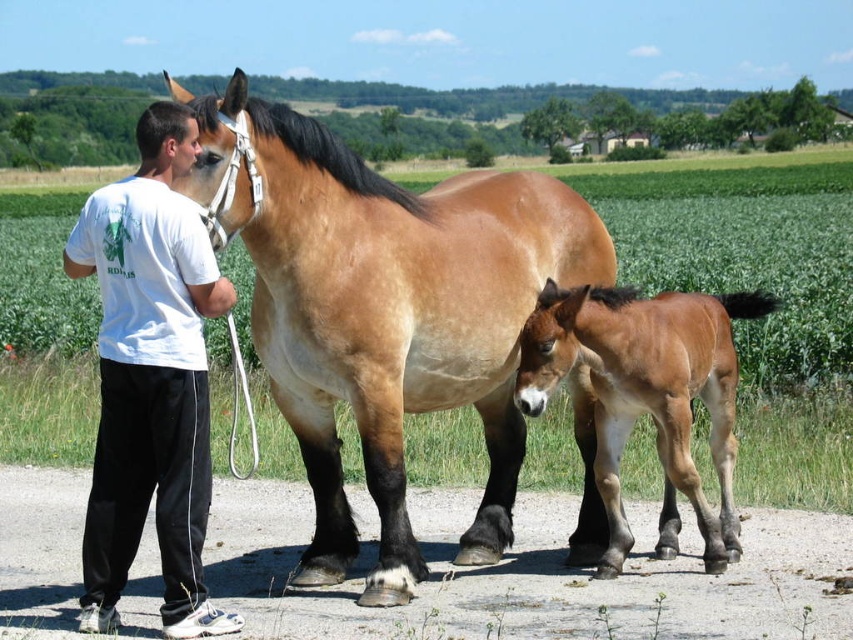
Is brown glossy horse at center taller than brown glossy foal at lower right?

No, brown glossy horse at center is not taller than brown glossy foal at lower right.

Does brown glossy horse at center lie in front of brown glossy foal at lower right?

Yes, it is in front of brown glossy foal at lower right.

Locate an element on the screen. brown glossy horse at center is located at coordinates (386, 310).

This screenshot has width=853, height=640. In order to click on brown glossy horse at center in this screenshot , I will do `click(386, 310)`.

The height and width of the screenshot is (640, 853). Describe the element at coordinates (149, 378) in the screenshot. I see `white cotton t-shirt at left` at that location.

Does white cotton t-shirt at left have a lesser height compared to brown glossy foal at lower right?

In fact, white cotton t-shirt at left may be taller than brown glossy foal at lower right.

At what (x,y) coordinates should I click in order to perform the action: click on white cotton t-shirt at left. Please return your answer as a coordinate pair (x, y). The image size is (853, 640). Looking at the image, I should click on (149, 378).

Where is `white cotton t-shirt at left`? This screenshot has height=640, width=853. white cotton t-shirt at left is located at coordinates (149, 378).

Is brown glossy horse at center closer to camera compared to white cotton t-shirt at left?

No.

Which is behind, point (315, 552) or point (119, 500)?

Positioned behind is point (315, 552).

This screenshot has height=640, width=853. Find the location of `brown glossy horse at center`. brown glossy horse at center is located at coordinates (386, 310).